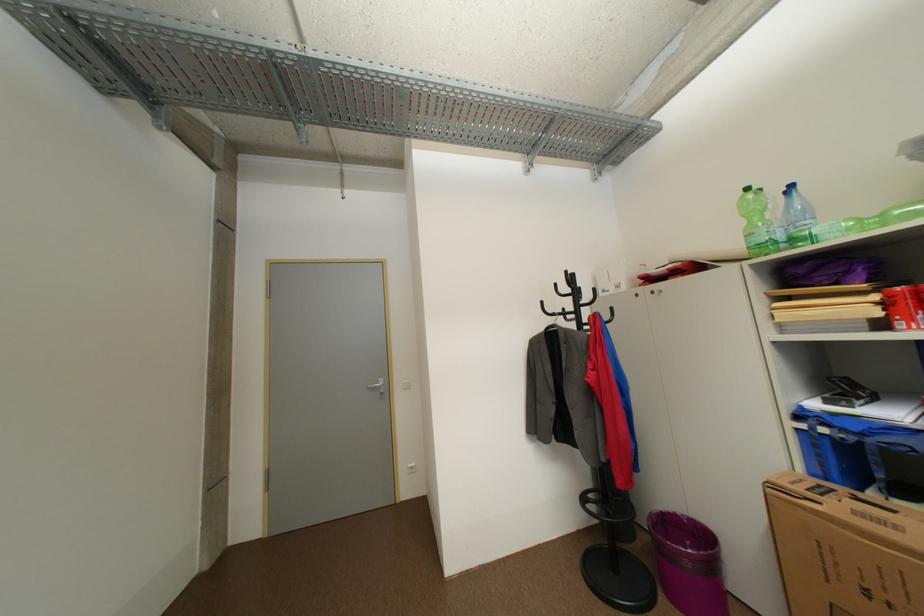
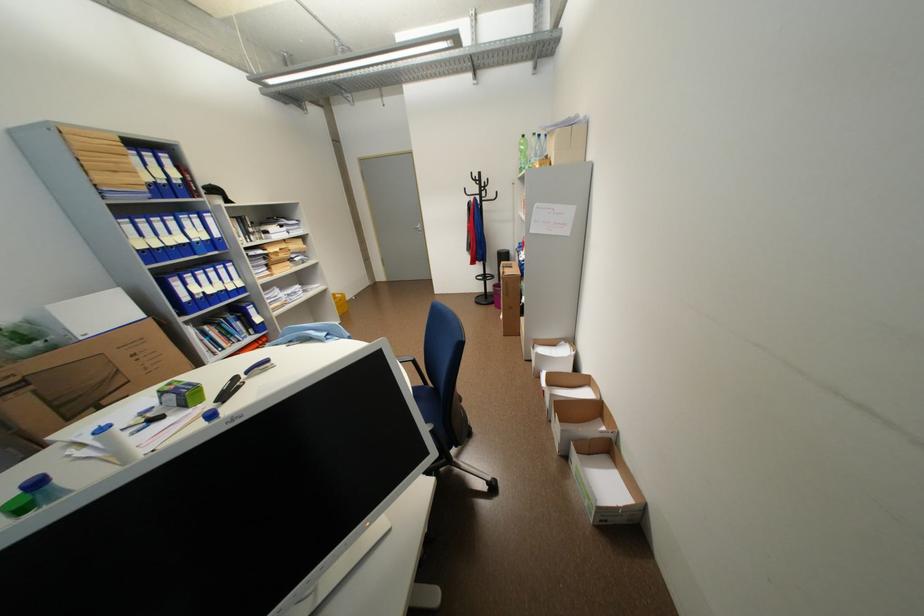
The point at (756,190) is marked in the first image. Where is the corresponding point in the second image?

(531, 137)